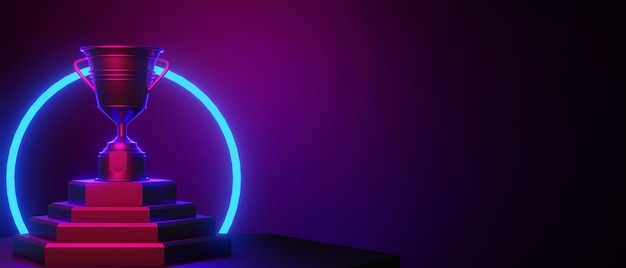
This screenshot has width=626, height=268. Find the location of `trophy`. trophy is located at coordinates (119, 86).